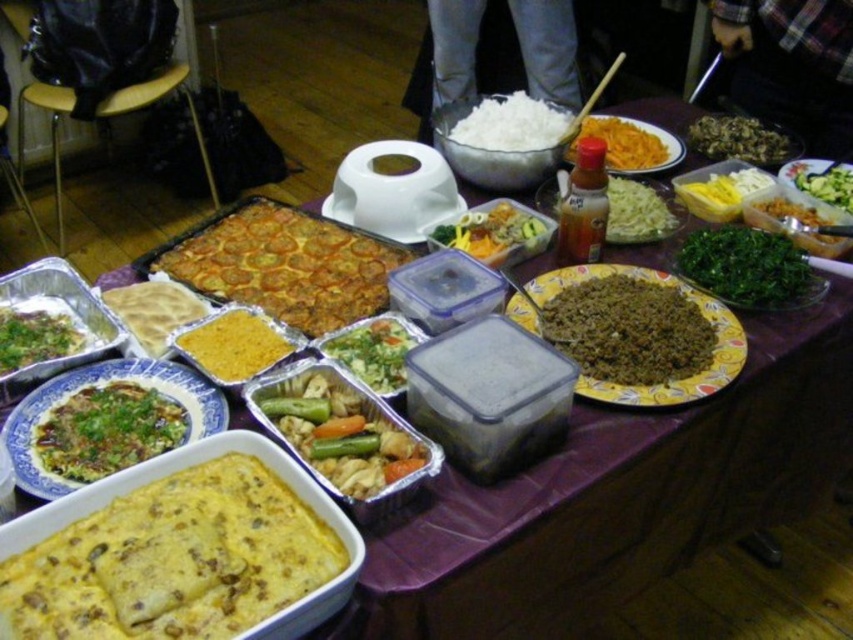
Who is positioned more to the right, translucent plastic bottle at center or yellowish matte carrot at center?

From the viewer's perspective, yellowish matte carrot at center appears more on the right side.

Does translucent plastic bottle at center have a larger size compared to yellowish matte carrot at center?

No.

Describe the element at coordinates (640, 211) in the screenshot. The image size is (853, 640). I see `translucent plastic bottle at center` at that location.

The width and height of the screenshot is (853, 640). I want to click on translucent plastic bottle at center, so click(640, 211).

Between green matte salad at center and matte white plate at center, which one has more height?

matte white plate at center

Does point (403, 326) lie in front of point (393, 173)?

That is True.

Where is `green matte salad at center`? Image resolution: width=853 pixels, height=640 pixels. green matte salad at center is located at coordinates (373, 352).

In the scene shown: Does green matte salad at center appear under green leafy vegetable at center?

Yes.

Does green matte salad at center have a greater height compared to green leafy vegetable at center?

No, green matte salad at center is not taller than green leafy vegetable at center.

Is point (358, 365) closer to camera compared to point (836, 250)?

Yes, point (358, 365) is closer to viewer.

This screenshot has height=640, width=853. Identify the location of green matte salad at center. (373, 352).